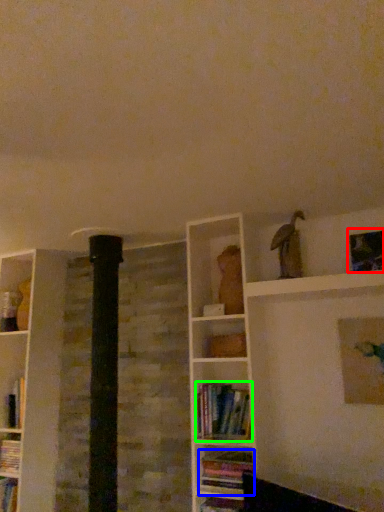
Question: Considering the real-world distances, which object is farthest from picture frame (highlighted by a red box)? book (highlighted by a blue box) or book (highlighted by a green box)?

Choices:
 (A) book
 (B) book

Answer: (A)